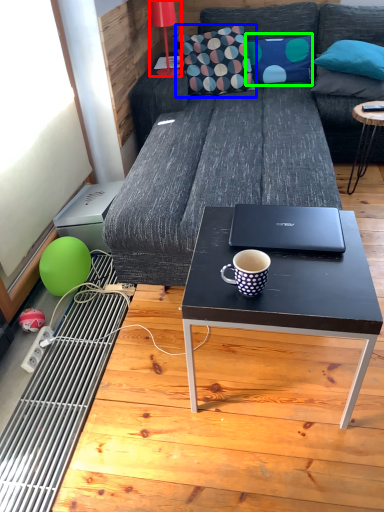
Question: Which is farther away from lamp (highlighted by a red box)? throw pillow (highlighted by a blue box) or pillow (highlighted by a green box)?

Choices:
 (A) throw pillow
 (B) pillow

Answer: (B)